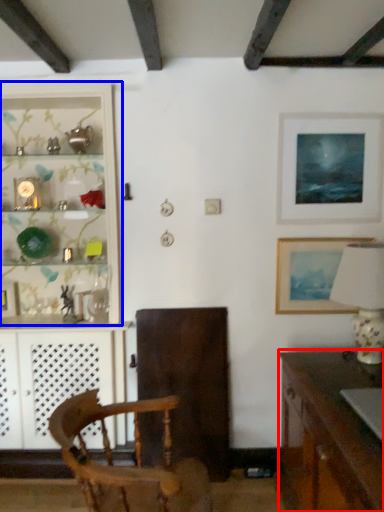
Question: Among these objects, which one is farthest to the camera, desk (highlighted by a red box) or shelf (highlighted by a blue box)?

Choices:
 (A) desk
 (B) shelf

Answer: (B)